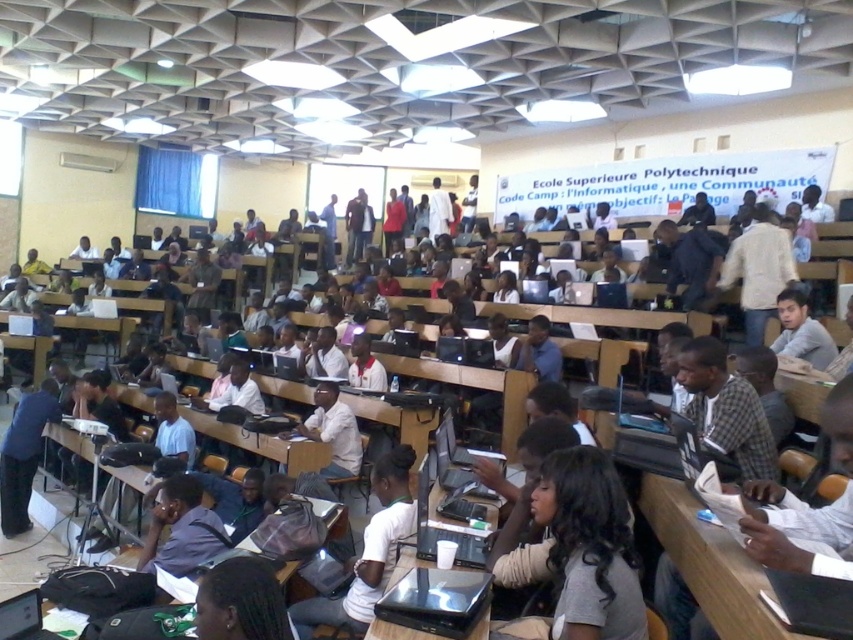
In the lecture hall scene, you notice a student with dark gray hair at center and another wearing a dark blue shirt at lower left. From the perspective of someone sitting at the front of the room, which student is positioned to the right?

The dark gray hair at center is to the right of the dark blue shirt at lower left, so from the front perspective, the dark gray hair at center is positioned to the right.

You are a photographer in the lecture hall and want to capture both the white matte shirt at center and the gray matte shirt at right in a single frame. Based on their positions, which shirt should you focus on first to ensure both are in the shot?

You should focus on the white matte shirt at center first because it is positioned to the left of the gray matte shirt at right, so adjusting the camera to include both from left to right ensures both are in frame.